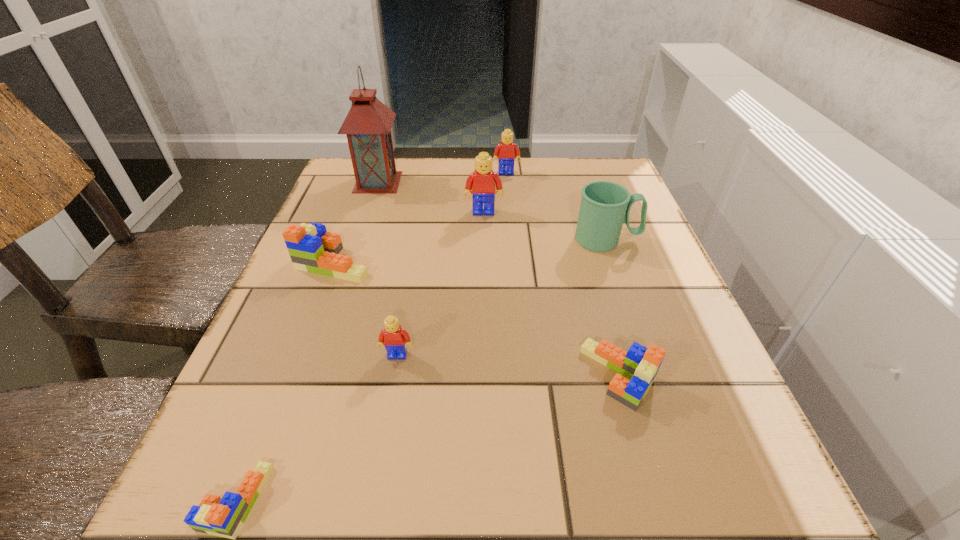
I want to click on pink lantern, so click(x=368, y=124).

The width and height of the screenshot is (960, 540). Find the location of `lantern`. lantern is located at coordinates (368, 124).

Where is `the biggest yellow Lego`? the biggest yellow Lego is located at coordinates (482, 181).

Where is `the tallest Lego`? The width and height of the screenshot is (960, 540). the tallest Lego is located at coordinates (482, 181).

The width and height of the screenshot is (960, 540). Find the location of `the farthest Lego`. the farthest Lego is located at coordinates (505, 151).

Where is `the farthest yellow Lego`? the farthest yellow Lego is located at coordinates (505, 151).

Identify the location of green mug. (605, 206).

Locate an element on the screen. Image resolution: width=960 pixels, height=540 pixels. the fourth nearest Lego is located at coordinates (312, 249).

Image resolution: width=960 pixels, height=540 pixels. I want to click on the farthest orange Lego, so click(312, 249).

At what (x,y) coordinates should I click in order to perform the action: click on the fifth object from right to left. Please return your answer as a coordinate pair (x, y). This screenshot has width=960, height=540. Looking at the image, I should click on (395, 339).